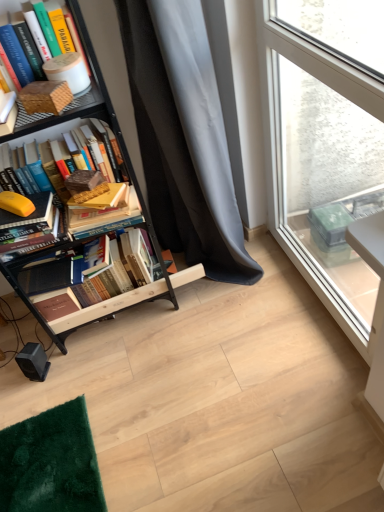
Identify the location of vacant location below gray fabric curtain at center (from a real-world perspective). Image resolution: width=384 pixels, height=512 pixels. (230, 287).